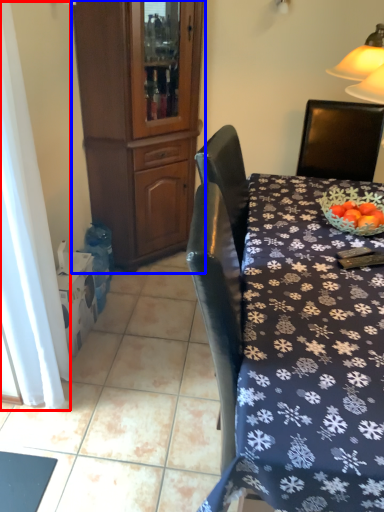
Question: Which of the following is the closest to the observer, curtain (highlighted by a red box) or cabinetry (highlighted by a blue box)?

Choices:
 (A) curtain
 (B) cabinetry

Answer: (A)